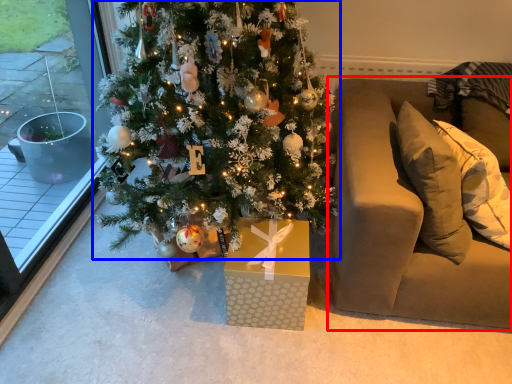
Question: Which object appears farthest to the camera in this image, studio couch (highlighted by a red box) or christmas tree (highlighted by a blue box)?

Choices:
 (A) studio couch
 (B) christmas tree

Answer: (A)